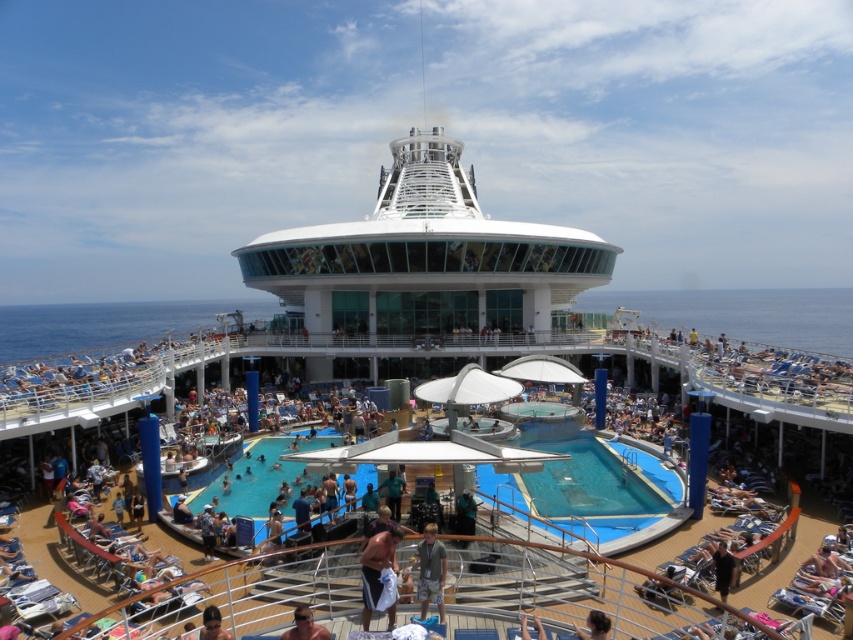
Does white towel at center come in front of gray fabric shorts at center?

That is True.

Identify the location of white towel at center. (376, 566).

The width and height of the screenshot is (853, 640). Identify the location of white towel at center. (376, 566).

Locate an element on the screen. The width and height of the screenshot is (853, 640). white towel at center is located at coordinates pyautogui.click(x=376, y=566).

Identify the location of gray fabric shorts at center. The height and width of the screenshot is (640, 853). (431, 572).

Can you confirm if gray fabric shorts at center is thinner than dark brown hair at lower right?

In fact, gray fabric shorts at center might be wider than dark brown hair at lower right.

Identify the location of gray fabric shorts at center. (431, 572).

Which is more to the right, blue rubber pool at center or gray fabric shorts at center?

From the viewer's perspective, blue rubber pool at center appears more on the right side.

Describe the element at coordinates (595, 490) in the screenshot. I see `blue rubber pool at center` at that location.

This screenshot has height=640, width=853. I want to click on blue rubber pool at center, so click(x=595, y=490).